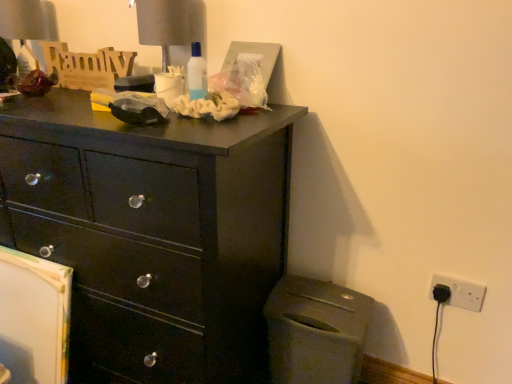
Question: From a real-world perspective, is white plastic electric outlet at lower right located higher than matte gray trash can at lower right?

Choices:
 (A) yes
 (B) no

Answer: (A)

Question: Is white plastic electric outlet at lower right touching matte gray trash can at lower right?

Choices:
 (A) yes
 (B) no

Answer: (B)

Question: Considering the relative sizes of white plastic electric outlet at lower right and matte gray trash can at lower right in the image provided, is white plastic electric outlet at lower right wider than matte gray trash can at lower right?

Choices:
 (A) no
 (B) yes

Answer: (A)

Question: Is matte gray trash can at lower right surrounded by white plastic electric outlet at lower right?

Choices:
 (A) no
 (B) yes

Answer: (A)

Question: Is white plastic electric outlet at lower right positioned in front of matte gray trash can at lower right?

Choices:
 (A) yes
 (B) no

Answer: (B)

Question: From their relative heights in the image, would you say matte black dresser at upper left is taller or shorter than matte gray table lamp at upper left, the second table lamp positioned from the right?

Choices:
 (A) short
 (B) tall

Answer: (B)

Question: From the image's perspective, is matte black dresser at upper left located above or below matte gray table lamp at upper left, the second table lamp positioned from the right?

Choices:
 (A) above
 (B) below

Answer: (B)

Question: From a real-world perspective, is matte black dresser at upper left positioned above or below matte gray table lamp at upper left, which appears as the 1th table lamp when viewed from the back?

Choices:
 (A) below
 (B) above

Answer: (A)

Question: Considering the positions of matte black dresser at upper left and matte gray table lamp at upper left, placed as the 1th table lamp when sorted from left to right, in the image, is matte black dresser at upper left wider or thinner than matte gray table lamp at upper left, placed as the 1th table lamp when sorted from left to right,?

Choices:
 (A) thin
 (B) wide

Answer: (B)

Question: Is point (236, 155) positioned closer to the camera than point (176, 61)?

Choices:
 (A) closer
 (B) farther

Answer: (A)

Question: Looking at their shapes, would you say matte black dresser at upper left is wider or thinner than matte gray table lamp at upper center, the 2th table lamp when ordered from back to front?

Choices:
 (A) thin
 (B) wide

Answer: (B)

Question: Is matte black dresser at upper left taller or shorter than matte gray table lamp at upper center, the 2th table lamp when ordered from back to front?

Choices:
 (A) tall
 (B) short

Answer: (A)

Question: Is matte black dresser at upper left in front of or behind matte gray table lamp at upper center, which is the second table lamp in left-to-right order, in the image?

Choices:
 (A) behind
 (B) front

Answer: (B)

Question: In terms of size, does matte gray trash can at lower right appear bigger or smaller than white plastic electric outlet at lower right?

Choices:
 (A) big
 (B) small

Answer: (A)

Question: Is matte gray trash can at lower right inside the boundaries of white plastic electric outlet at lower right, or outside?

Choices:
 (A) inside
 (B) outside

Answer: (B)